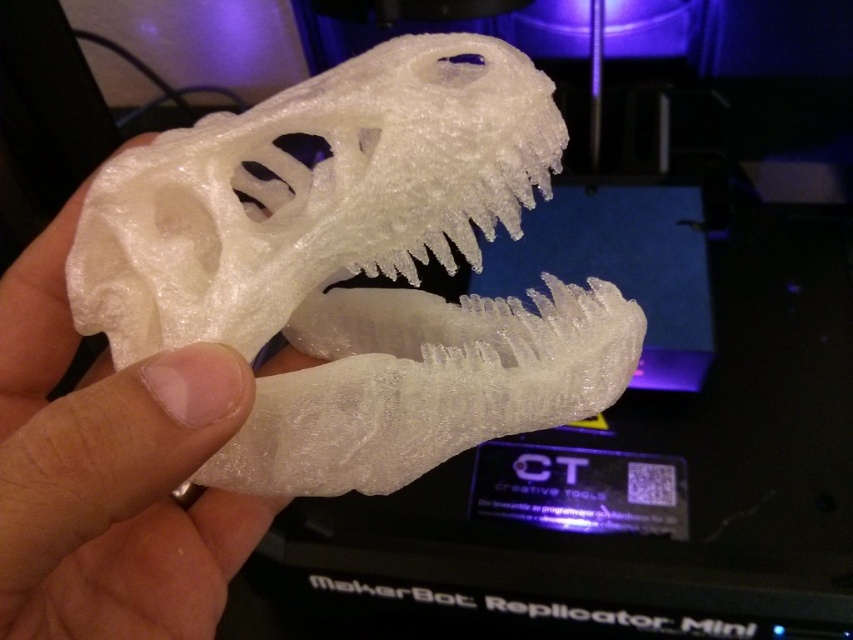
Question: Is white matte plastic dinosaur skull at center closer to camera compared to white matte plastic hand at center?

Choices:
 (A) no
 (B) yes

Answer: (A)

Question: Which of the following is the farthest from the observer?

Choices:
 (A) white matte plastic dinosaur skull at center
 (B) white matte plastic hand at center

Answer: (A)

Question: Which point appears farthest from the camera in this image?

Choices:
 (A) (605, 385)
 (B) (183, 401)

Answer: (A)

Question: Does white matte plastic dinosaur skull at center have a larger size compared to white matte plastic hand at center?

Choices:
 (A) yes
 (B) no

Answer: (B)

Question: Which point is closer to the camera?

Choices:
 (A) white matte plastic dinosaur skull at center
 (B) white matte plastic hand at center

Answer: (B)

Question: Does white matte plastic dinosaur skull at center have a lesser width compared to white matte plastic hand at center?

Choices:
 (A) no
 (B) yes

Answer: (A)